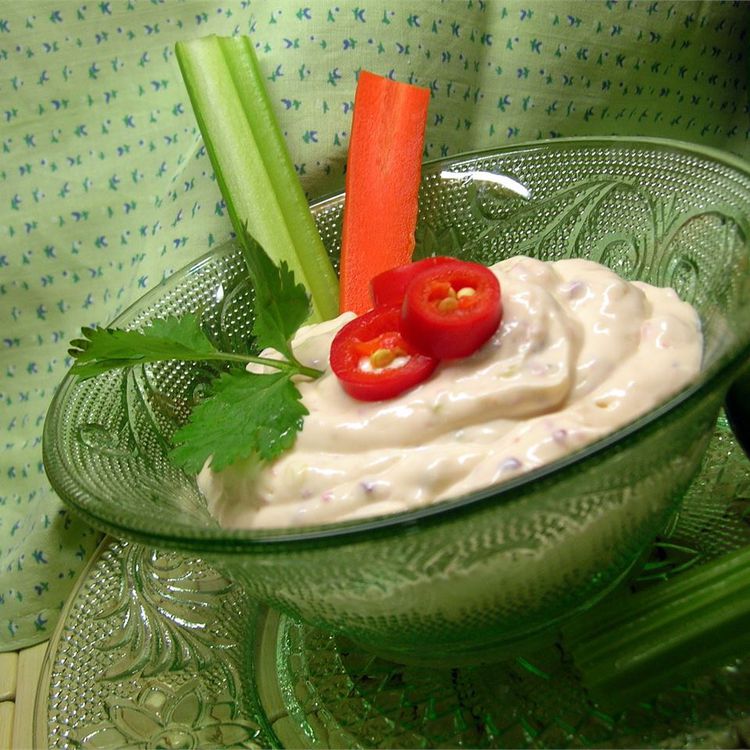
You are a GUI agent. You are given a task and a screenshot of the screen. Output one action in this format:
    pyautogui.click(x=<x>, y=<y>)
    Task: Click on the light wood table
    
    Given the screenshot: What is the action you would take?
    pyautogui.click(x=27, y=684)